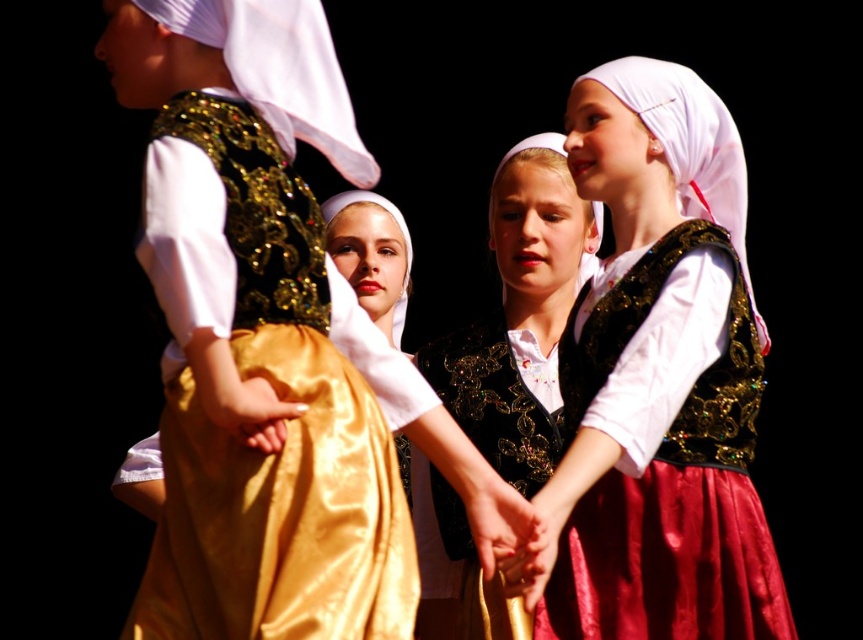
Consider the image. Based on the scene description, where is the shiny gold skirt at center located in terms of its 2D coordinates?

The shiny gold skirt at center is located at the 2D coordinates of point (662, 378).

You are organizing a cultural performance and need to arrange the shiny gold skirt at center and the smooth golden fabric at center on a stage. Given their widths, which one should be placed closer to the audience to ensure visibility?

The shiny gold skirt at center should be placed closer to the audience because it is wider than the smooth golden fabric at center, making it more visible from the front.